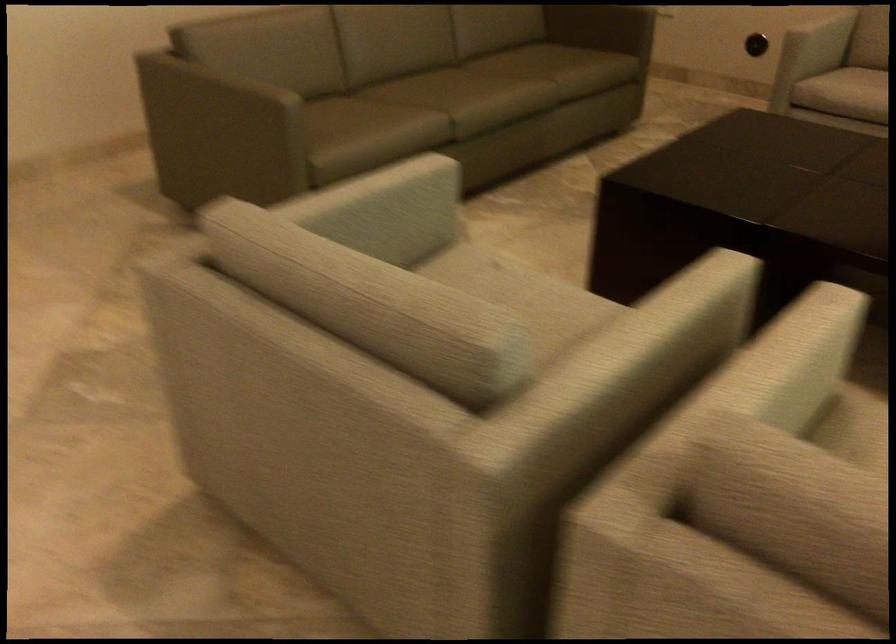
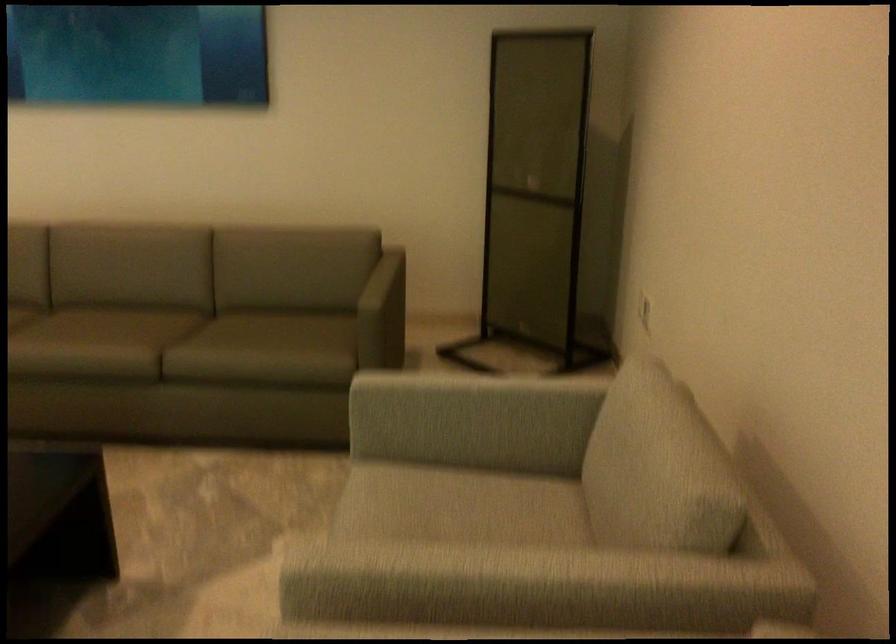
In the second image, find the point that corresponds to (x=468, y=73) in the first image.

(128, 327)